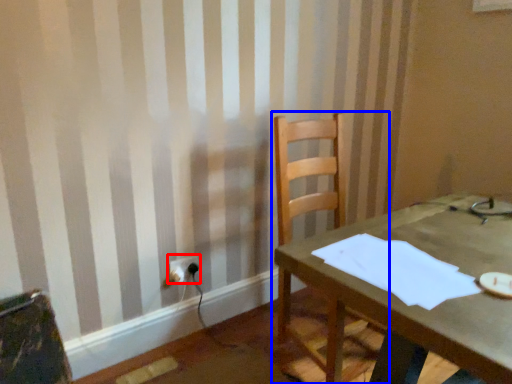
Question: Among these objects, which one is nearest to the camera, electric outlet (highlighted by a red box) or chair (highlighted by a blue box)?

Choices:
 (A) electric outlet
 (B) chair

Answer: (B)